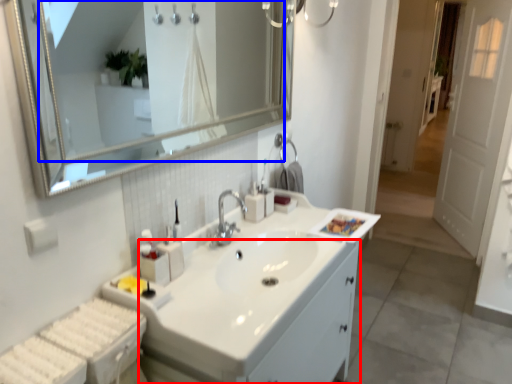
Question: Among these objects, which one is farthest to the camera, bathroom cabinet (highlighted by a red box) or mirror (highlighted by a blue box)?

Choices:
 (A) bathroom cabinet
 (B) mirror

Answer: (A)